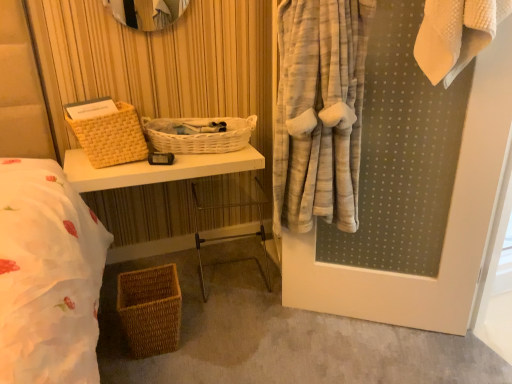
At what (x,y) coordinates should I click in order to perform the action: click on woven wood table at center. Please return your answer as a coordinate pair (x, y). Looking at the image, I should click on coord(156,169).

What is the approximate height of woven brown basket at lower left, which is counted as the third basket, starting from the top?

woven brown basket at lower left, which is counted as the third basket, starting from the top, is 10.83 inches in height.

In order to face woven brown basket at lower left, which is counted as the third basket, starting from the top, should I rotate leftwards or rightwards?

You should look left and rotate roughly 14.101 degrees.

Where is `woven wood table at center`? Image resolution: width=512 pixels, height=384 pixels. woven wood table at center is located at coordinates (156, 169).

Is woven wood table at center turned away from woven brown basket at lower left, marked as the first basket in a bottom-to-top arrangement?

No, woven wood table at center is not facing away from woven brown basket at lower left, marked as the first basket in a bottom-to-top arrangement.

From a real-world perspective, is woven wood table at center physically located above or below woven brown basket at lower left, which is counted as the third basket, starting from the top?

woven wood table at center is above woven brown basket at lower left, which is counted as the third basket, starting from the top.

Considering the sizes of woven wood table at center and woven brown basket at lower left, marked as the first basket in a bottom-to-top arrangement, in the image, is woven wood table at center wider or thinner than woven brown basket at lower left, marked as the first basket in a bottom-to-top arrangement,?

woven wood table at center is wider than woven brown basket at lower left, marked as the first basket in a bottom-to-top arrangement.

Is woven wood table at center located outside woven brown basket at lower left, marked as the first basket in a bottom-to-top arrangement?

Yes.

From a real-world perspective, which object rests below the other?

From a 3D spatial view, woven brown basket at lower left, which is counted as the third basket, starting from the top, is below.

Is white wicker basket at center, which ranks as the first basket in top-to-bottom order, positioned in front of woven brown basket at lower left, marked as the first basket in a bottom-to-top arrangement?

No, it is behind woven brown basket at lower left, marked as the first basket in a bottom-to-top arrangement.

From the image's perspective, would you say white wicker basket at center, which ranks as the first basket in top-to-bottom order, is positioned over woven brown basket at lower left, marked as the first basket in a bottom-to-top arrangement?

Yes, from the image's perspective, white wicker basket at center, which ranks as the first basket in top-to-bottom order, is on top of woven brown basket at lower left, marked as the first basket in a bottom-to-top arrangement.

Find the location of a particular element. This screenshot has width=512, height=384. the 1st basket counting from the left of the white wicker basket at center, the third basket positioned from the bottom is located at coordinates (150, 309).

Is point (194, 141) closer to viewer compared to point (101, 151)?

No.

How far apart are white wicker basket at center, the third basket positioned from the bottom, and woven wicker basket at left, which is the second basket in bottom-to-top order?

They are 8.03 inches apart.

Between white wicker basket at center, the third basket positioned from the bottom, and woven wicker basket at left, which is the second basket in bottom-to-top order, which one appears on the left side from the viewer's perspective?

From the viewer's perspective, woven wicker basket at left, which is the second basket in bottom-to-top order, appears more on the left side.

Is white wicker basket at center, which ranks as the first basket in top-to-bottom order, inside or outside of woven wicker basket at left, which ranks as the second basket in top-to-bottom order?

white wicker basket at center, which ranks as the first basket in top-to-bottom order, is not enclosed by woven wicker basket at left, which ranks as the second basket in top-to-bottom order.

Does point (153, 337) come in front of point (221, 140)?

Yes, it is in front of point (221, 140).

From the image's perspective, is woven brown basket at lower left, marked as the first basket in a bottom-to-top arrangement, located above or below white wicker basket at center, which ranks as the first basket in top-to-bottom order?

woven brown basket at lower left, marked as the first basket in a bottom-to-top arrangement, is below white wicker basket at center, which ranks as the first basket in top-to-bottom order.

Is there a large distance between woven brown basket at lower left, which is counted as the third basket, starting from the top, and white wicker basket at center, which ranks as the first basket in top-to-bottom order?

No, there isn't a large distance between woven brown basket at lower left, which is counted as the third basket, starting from the top, and white wicker basket at center, which ranks as the first basket in top-to-bottom order.

From a real-world perspective, which is physically below, woven brown basket at lower left, marked as the first basket in a bottom-to-top arrangement, or woven wicker basket at left, which ranks as the second basket in top-to-bottom order?

From a 3D spatial view, woven brown basket at lower left, marked as the first basket in a bottom-to-top arrangement, is below.

Considering the sizes of objects woven brown basket at lower left, marked as the first basket in a bottom-to-top arrangement, and woven wicker basket at left, which is the second basket in bottom-to-top order, in the image provided, who is thinner, woven brown basket at lower left, marked as the first basket in a bottom-to-top arrangement, or woven wicker basket at left, which is the second basket in bottom-to-top order,?

With smaller width is woven brown basket at lower left, marked as the first basket in a bottom-to-top arrangement.

Considering the positions of objects woven brown basket at lower left, which is counted as the third basket, starting from the top, and woven wicker basket at left, which is the second basket in bottom-to-top order, in the image provided, who is behind, woven brown basket at lower left, which is counted as the third basket, starting from the top, or woven wicker basket at left, which is the second basket in bottom-to-top order,?

woven wicker basket at left, which is the second basket in bottom-to-top order, is more distant.

Is the surface of woven brown basket at lower left, which is counted as the third basket, starting from the top, in direct contact with woven wicker basket at left, which is the second basket in bottom-to-top order?

No.

Is woven wicker basket at left, which ranks as the second basket in top-to-bottom order, wider than white wicker basket at center, the third basket positioned from the bottom?

Incorrect, the width of woven wicker basket at left, which ranks as the second basket in top-to-bottom order, does not surpass that of white wicker basket at center, the third basket positioned from the bottom.

Considering the sizes of woven wicker basket at left, which is the second basket in bottom-to-top order, and white wicker basket at center, which ranks as the first basket in top-to-bottom order, in the image, is woven wicker basket at left, which is the second basket in bottom-to-top order, taller or shorter than white wicker basket at center, which ranks as the first basket in top-to-bottom order,?

woven wicker basket at left, which is the second basket in bottom-to-top order, is taller than white wicker basket at center, which ranks as the first basket in top-to-bottom order.

Would you consider woven wicker basket at left, which ranks as the second basket in top-to-bottom order, to be distant from white wicker basket at center, which ranks as the first basket in top-to-bottom order?

No, there isn't a large distance between woven wicker basket at left, which ranks as the second basket in top-to-bottom order, and white wicker basket at center, which ranks as the first basket in top-to-bottom order.

Which object is wider, clear plastic chair at center or woven wood table at center?

Wider between the two is woven wood table at center.

Considering the sizes of objects clear plastic chair at center and woven wood table at center in the image provided, who is taller, clear plastic chair at center or woven wood table at center?

Standing taller between the two is woven wood table at center.

How far apart are clear plastic chair at center and woven wood table at center?

They are 14.36 inches apart.

From the image's perspective, which one is positioned higher, clear plastic chair at center or woven wood table at center?

woven wood table at center.

You are a GUI agent. You are given a task and a screenshot of the screen. Output one action in this format:
    pyautogui.click(x=<x>, y=<y>)
    Task: Click on the basket below the woven wood table at center (from the image's perspective)
    
    Given the screenshot: What is the action you would take?
    pyautogui.click(x=150, y=309)

The height and width of the screenshot is (384, 512). I want to click on the 2nd basket in front of the white wicker basket at center, the third basket positioned from the bottom, counting from the anchor's position, so pyautogui.click(x=150, y=309).

Looking at the image, which one is located further to white wicker basket at center, the third basket positioned from the bottom, woven wood table at center or woven wicker basket at left, which ranks as the second basket in top-to-bottom order?

Based on the image, woven wicker basket at left, which ranks as the second basket in top-to-bottom order, appears to be further to white wicker basket at center, the third basket positioned from the bottom.

From the image, which object appears to be farther from white wicker basket at center, the third basket positioned from the bottom, woven brown basket at lower left, which is counted as the third basket, starting from the top, or woven wood table at center?

Based on the image, woven brown basket at lower left, which is counted as the third basket, starting from the top, appears to be further to white wicker basket at center, the third basket positioned from the bottom.

From the picture: Based on their spatial positions, is woven brown basket at lower left, which is counted as the third basket, starting from the top, or white wicker basket at center, the third basket positioned from the bottom, closer to woven wicker basket at left, which is the second basket in bottom-to-top order?

The object closer to woven wicker basket at left, which is the second basket in bottom-to-top order, is white wicker basket at center, the third basket positioned from the bottom.

Looking at the image, which one is located further to woven brown basket at lower left, marked as the first basket in a bottom-to-top arrangement, woven wood table at center or woven wicker basket at left, which is the second basket in bottom-to-top order?

Based on the image, woven wicker basket at left, which is the second basket in bottom-to-top order, appears to be further to woven brown basket at lower left, marked as the first basket in a bottom-to-top arrangement.

Considering their positions, is clear plastic chair at center positioned further to woven wood table at center than woven brown basket at lower left, marked as the first basket in a bottom-to-top arrangement?

woven brown basket at lower left, marked as the first basket in a bottom-to-top arrangement, is positioned further to the anchor woven wood table at center.

Looking at the image, which one is located closer to white wicker basket at center, which ranks as the first basket in top-to-bottom order, woven wood table at center or woven brown basket at lower left, marked as the first basket in a bottom-to-top arrangement?

Based on the image, woven wood table at center appears to be nearer to white wicker basket at center, which ranks as the first basket in top-to-bottom order.

When comparing their distances from white wicker basket at center, which ranks as the first basket in top-to-bottom order, does woven brown basket at lower left, marked as the first basket in a bottom-to-top arrangement, or woven wicker basket at left, which ranks as the second basket in top-to-bottom order, seem closer?

The object closer to white wicker basket at center, which ranks as the first basket in top-to-bottom order, is woven wicker basket at left, which ranks as the second basket in top-to-bottom order.

Which object lies nearer to the anchor point white wicker basket at center, the third basket positioned from the bottom, clear plastic chair at center or woven wood table at center?

The object closer to white wicker basket at center, the third basket positioned from the bottom, is woven wood table at center.

Where is `chair between woven wood table at center and woven brown basket at lower left, marked as the first basket in a bottom-to-top arrangement, vertically`? Image resolution: width=512 pixels, height=384 pixels. chair between woven wood table at center and woven brown basket at lower left, marked as the first basket in a bottom-to-top arrangement, vertically is located at coordinates (229, 208).

Locate an element on the screen. The width and height of the screenshot is (512, 384). table that lies between white wicker basket at center, the third basket positioned from the bottom, and clear plastic chair at center from top to bottom is located at coordinates (156, 169).

Where is `basket between white wicker basket at center, the third basket positioned from the bottom, and woven brown basket at lower left, which is counted as the third basket, starting from the top, in the up-down direction`? The width and height of the screenshot is (512, 384). basket between white wicker basket at center, the third basket positioned from the bottom, and woven brown basket at lower left, which is counted as the third basket, starting from the top, in the up-down direction is located at coordinates (111, 136).

Where is `chair between woven wicker basket at left, which is the second basket in bottom-to-top order, and woven brown basket at lower left, which is counted as the third basket, starting from the top, vertically`? This screenshot has width=512, height=384. chair between woven wicker basket at left, which is the second basket in bottom-to-top order, and woven brown basket at lower left, which is counted as the third basket, starting from the top, vertically is located at coordinates (229, 208).